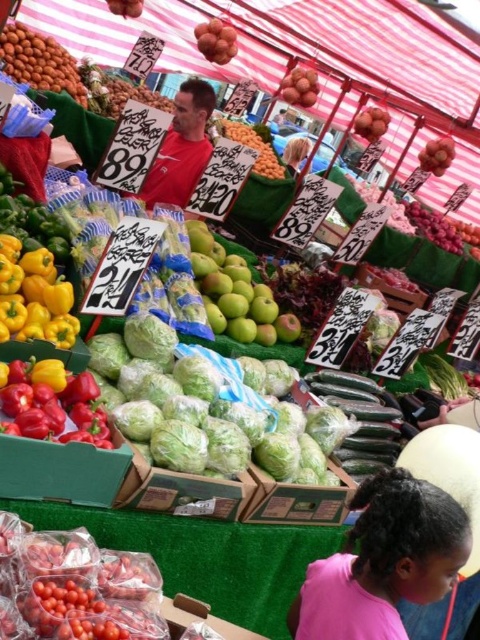
You are standing at the point labeled point (379, 550) and want to reach the entrance of the market located 1.32 meters away. Is there enough space between you and the entrance to walk through comfortably?

The distance between you and the entrance is exactly 1.32 meters, which is sufficient for comfortable passage as most people require about 1 meter of space to walk comfortably.

You are a customer at the farmer market. You see a smooth red pepper at lower left and a red matte shirt at center. Which item is shorter in height?

The smooth red pepper at lower left is shorter in height compared to the red matte shirt at center.